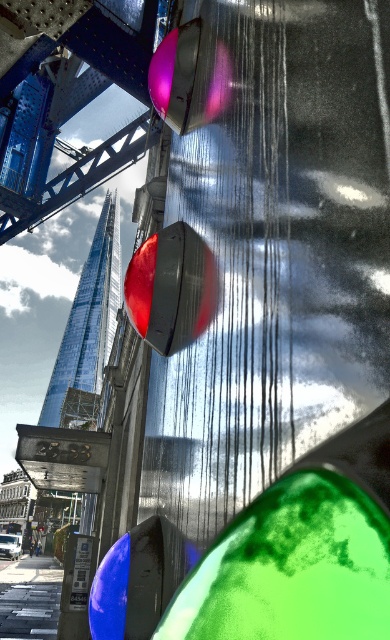
You are a photographer standing in the street and see the matte black traffic light at center and the matte black traffic light at upper center in your viewfinder. Which traffic light appears taller in the photo?

The matte black traffic light at upper center appears taller than the matte black traffic light at center because it is closer to the photographer, making it look larger in the photo.